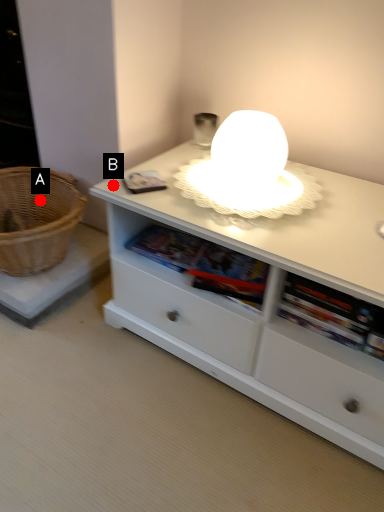
Question: Two points are circled on the image, labeled by A and B beside each circle. Which point is farther from the camera taking this photo?

Choices:
 (A) A is further
 (B) B is further

Answer: (A)